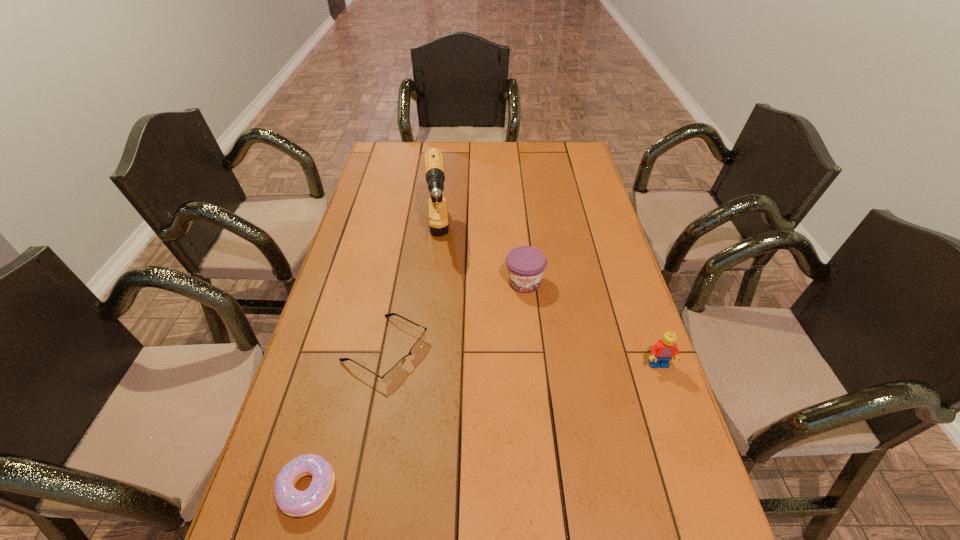
At what (x,y) coordinates should I click in order to perform the action: click on vacant space located 0.140m at the tip of the tallest object. Please return your answer as a coordinate pair (x, y). The image size is (960, 540). Looking at the image, I should click on (437, 305).

This screenshot has width=960, height=540. I want to click on free space located at the tip of the tallest object, so click(x=440, y=356).

Where is `vacant point located on the front label of the third tallest object`? vacant point located on the front label of the third tallest object is located at coordinates (550, 410).

Locate an element on the screen. The image size is (960, 540). vacant space located on the front label of the third tallest object is located at coordinates (536, 336).

You are a GUI agent. You are given a task and a screenshot of the screen. Output one action in this format:
    pyautogui.click(x=<x>, y=<y>)
    Task: Click on the vacant space located on the front label of the third tallest object
    
    Given the screenshot: What is the action you would take?
    pyautogui.click(x=547, y=395)

This screenshot has width=960, height=540. I want to click on vacant space located on the front-facing side of the spectacles, so click(543, 439).

Image resolution: width=960 pixels, height=540 pixels. In order to click on free space located 0.250m on the front-facing side of the spectacles in this screenshot , I will do `click(504, 417)`.

Identify the location of vacant space located 0.390m on the front-facing side of the spectacles. (560, 448).

At what (x,y) coordinates should I click in order to perform the action: click on object that is at the near edge. Please return your answer as a coordinate pair (x, y). Looking at the image, I should click on (292, 502).

This screenshot has width=960, height=540. In order to click on doughnut present at the left edge in this screenshot , I will do `click(292, 502)`.